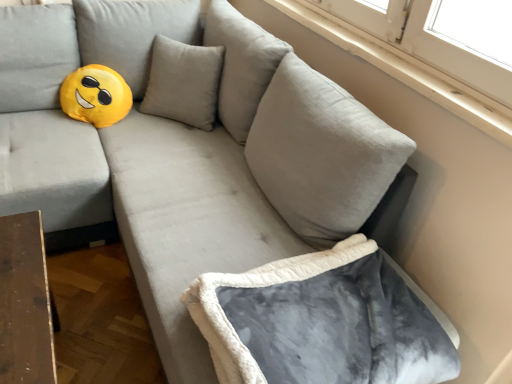
Question: Should I look upward or downward to see gray fleece bean bag chair at lower right?

Choices:
 (A) down
 (B) up

Answer: (A)

Question: Is white smooth window sill at upper right aimed at gray fleece bean bag chair at lower right?

Choices:
 (A) no
 (B) yes

Answer: (A)

Question: Can you confirm if white smooth window sill at upper right is taller than gray fleece bean bag chair at lower right?

Choices:
 (A) no
 (B) yes

Answer: (A)

Question: From the image's perspective, is white smooth window sill at upper right located beneath gray fleece bean bag chair at lower right?

Choices:
 (A) no
 (B) yes

Answer: (A)

Question: Is white smooth window sill at upper right positioned behind gray fleece bean bag chair at lower right?

Choices:
 (A) yes
 (B) no

Answer: (A)

Question: Considering the relative sizes of white smooth window sill at upper right and gray fleece bean bag chair at lower right in the image provided, is white smooth window sill at upper right smaller than gray fleece bean bag chair at lower right?

Choices:
 (A) yes
 (B) no

Answer: (A)

Question: Can you confirm if white smooth window sill at upper right is wider than gray fleece bean bag chair at lower right?

Choices:
 (A) yes
 (B) no

Answer: (B)

Question: Is gray fleece bean bag chair at lower right to the right of white smooth window sill at upper right from the viewer's perspective?

Choices:
 (A) no
 (B) yes

Answer: (A)

Question: Is gray fleece bean bag chair at lower right facing away from white smooth window sill at upper right?

Choices:
 (A) yes
 (B) no

Answer: (B)

Question: Is the depth of gray fleece bean bag chair at lower right greater than that of white smooth window sill at upper right?

Choices:
 (A) no
 (B) yes

Answer: (A)

Question: Is gray fleece bean bag chair at lower right outside white smooth window sill at upper right?

Choices:
 (A) yes
 (B) no

Answer: (A)

Question: From a real-world perspective, is gray fleece bean bag chair at lower right beneath white smooth window sill at upper right?

Choices:
 (A) yes
 (B) no

Answer: (A)

Question: Considering the relative positions of gray fleece bean bag chair at lower right and white smooth window sill at upper right in the image provided, is gray fleece bean bag chair at lower right to the left of white smooth window sill at upper right from the viewer's perspective?

Choices:
 (A) no
 (B) yes

Answer: (B)

Question: Does point (479, 112) appear closer or farther from the camera than point (404, 327)?

Choices:
 (A) farther
 (B) closer

Answer: (A)